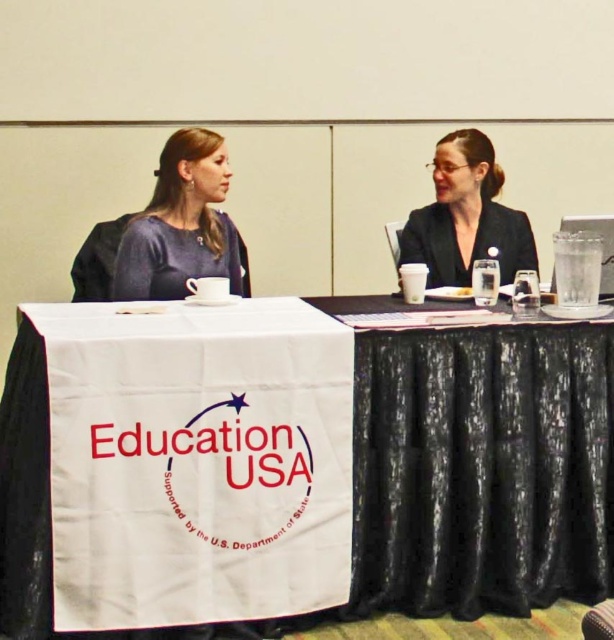
Between matte blue dress at center and matte black blazer at center, which one is positioned lower?

matte blue dress at center

Does matte blue dress at center have a lesser height compared to matte black blazer at center?

In fact, matte blue dress at center may be taller than matte black blazer at center.

Based on the photo, measure the distance between point (154, 250) and camera.

They are 10.46 feet apart.

Where is `matte blue dress at center`? This screenshot has height=640, width=614. matte blue dress at center is located at coordinates (181, 225).

In the scene shown: Which is above, white fabric table at center or matte black blazer at center?

matte black blazer at center is higher up.

Is point (585, 593) positioned after point (510, 209)?

No, it is not.

Identify the location of white fabric table at center. The image size is (614, 640). (478, 472).

Is white fabric table at center to the right of matte blue dress at center from the viewer's perspective?

Correct, you'll find white fabric table at center to the right of matte blue dress at center.

Is white fabric table at center positioned in front of matte blue dress at center?

Yes.

Between point (608, 573) and point (168, 211), which one is positioned behind?

Point (168, 211)

Locate an element on the screen. This screenshot has width=614, height=640. white fabric table at center is located at coordinates (478, 472).